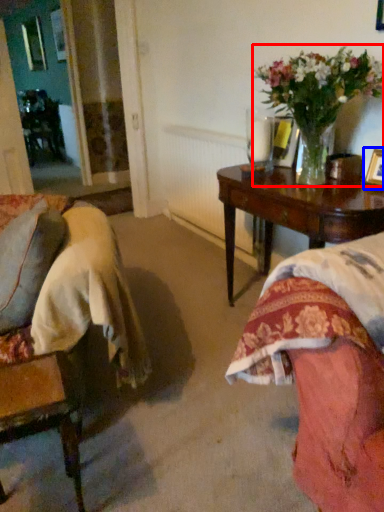
Question: Which point is further to the camera, houseplant (highlighted by a red box) or picture frame (highlighted by a blue box)?

Choices:
 (A) houseplant
 (B) picture frame

Answer: (B)